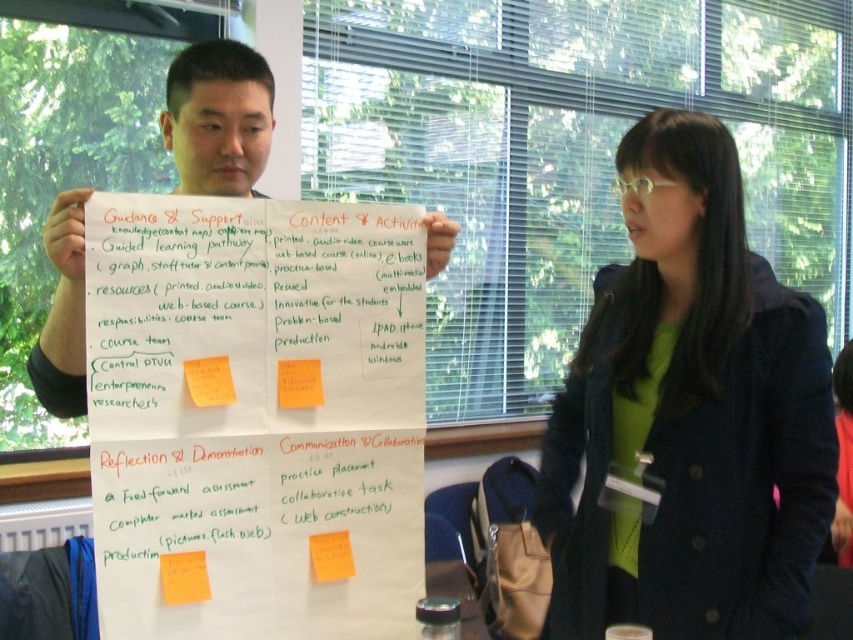
You are organizing a classroom activity and need to place two important notes on a desk. The white paper at center and yellow paper at center must be placed such that there is enough space between them for a ruler to fit. The ruler is 20 centimeters long. Can you fit the ruler between them?

The white paper at center and yellow paper at center are 18.95 centimeters apart. Since the ruler is 20 centimeters long, which is longer than the distance between them, you cannot fit the ruler between them.

Based on the photo, you are a photographer standing in the room. You want to take a close up photo of the white paper at center. The camera you are using has a minimum focusing distance of 1 meter. Can you take the photo without moving closer?

The white paper at center is 1.13 meters away from the camera. Since the minimum focusing distance is 1 meter, the camera can focus on the white paper at center as it is within range.